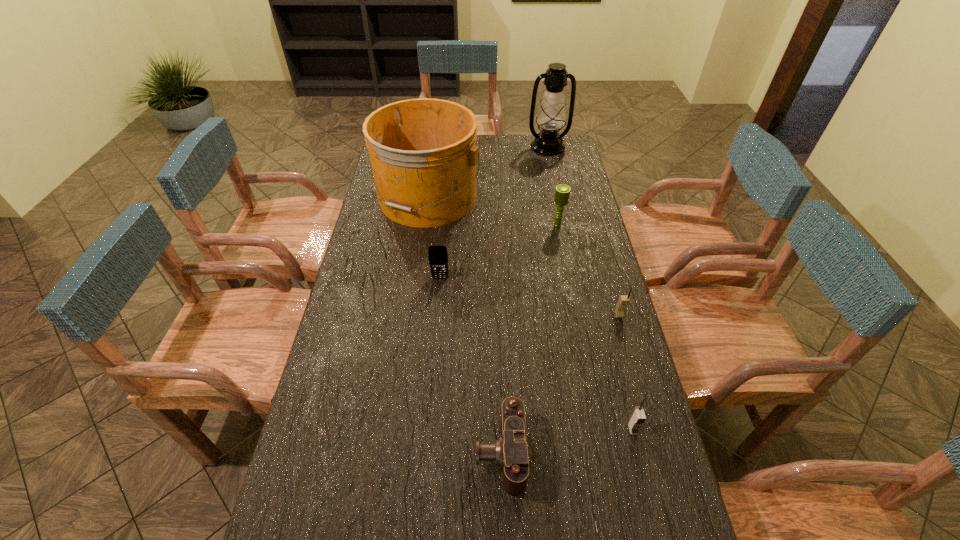
Where is `oil lamp located at the right edge`? oil lamp located at the right edge is located at coordinates (551, 117).

You are a GUI agent. You are given a task and a screenshot of the screen. Output one action in this format:
    pyautogui.click(x=<x>, y=<y>)
    Task: Click on the microphone at the right edge
    The height and width of the screenshot is (540, 960).
    Given the screenshot: What is the action you would take?
    pyautogui.click(x=562, y=192)

Locate an element on the screen. object positioned at the far right corner is located at coordinates click(551, 117).

The height and width of the screenshot is (540, 960). I want to click on free location at the far edge of the desktop, so click(x=485, y=144).

Find the location of a particular element. This screenshot has width=960, height=540. vacant area at the left edge is located at coordinates click(336, 339).

The height and width of the screenshot is (540, 960). I want to click on vacant space at the right edge of the desktop, so click(574, 225).

In the image, there is a desktop. Where is `vacant space at the far right corner`? vacant space at the far right corner is located at coordinates (572, 158).

Identify the location of unoccupied area between the farthest cellular telephone and the rightmost object. This screenshot has width=960, height=540. (530, 296).

At what (x,y) coordinates should I click in order to perform the action: click on free point between the seventh shortest object and the farthest object. Please return your answer as a coordinate pair (x, y). Looking at the image, I should click on (487, 172).

Where is `free space between the fifth farthest object and the second tallest object`? free space between the fifth farthest object and the second tallest object is located at coordinates (522, 256).